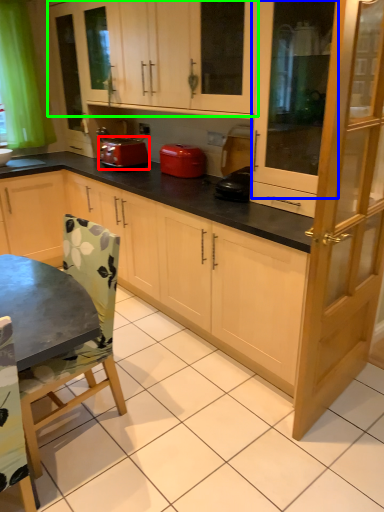
Question: Based on their relative distances, which object is nearer to kitchen appliance (highlighted by a red box)? Choose from screen door (highlighted by a blue box) and cabinetry (highlighted by a green box).

Choices:
 (A) screen door
 (B) cabinetry

Answer: (B)